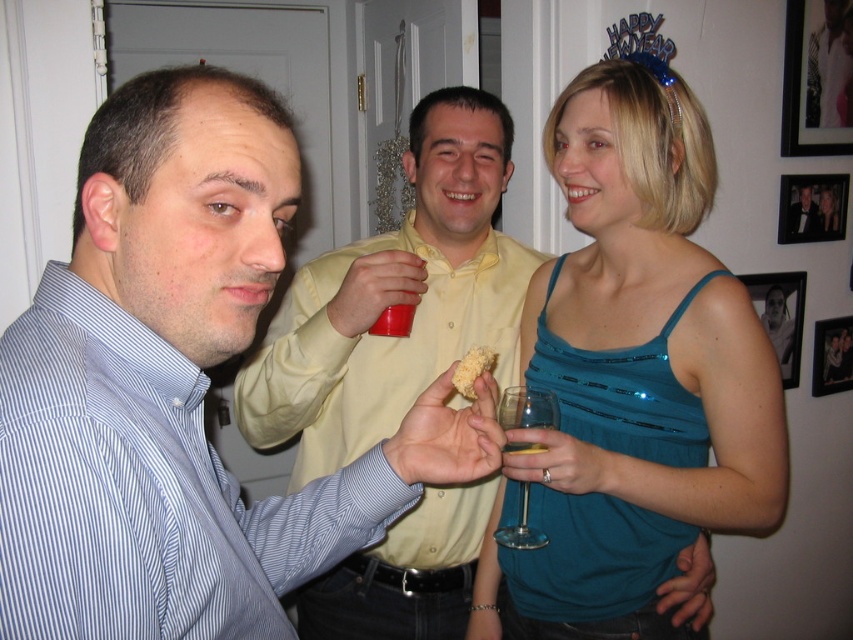
What is located at the coordinates point (631,374)?

The teal sequined tank top at upper right is located at point (631,374).

You are at a party and need to choose between the transparent glass wine glass at lower center and the metallic silver frame at upper right to place a 10cm tall candle. Which one can accommodate the candle?

The transparent glass wine glass at lower center is much taller than the metallic silver frame at upper right, so the candle can be placed in the transparent glass wine glass at lower center.